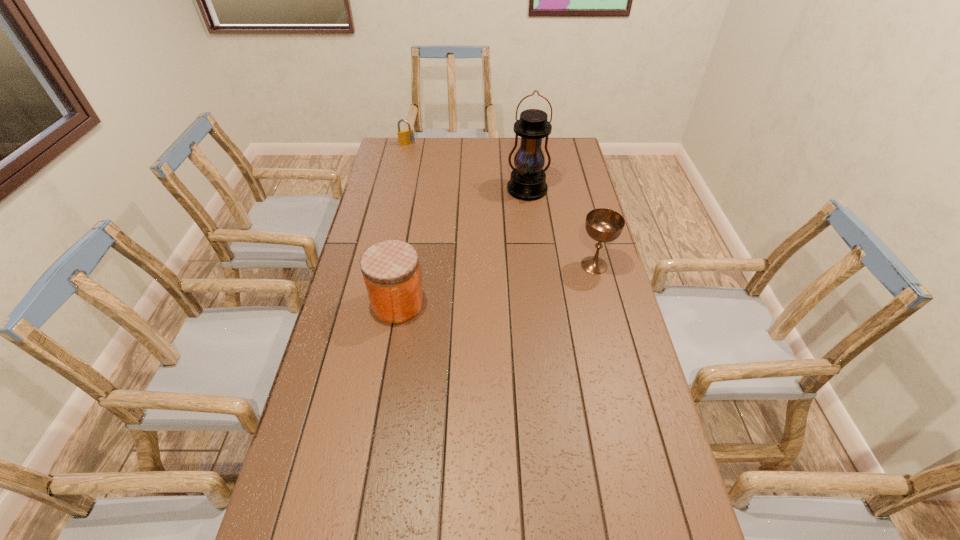
Locate an element on the screen. This screenshot has height=540, width=960. the nearest object is located at coordinates (390, 268).

The width and height of the screenshot is (960, 540). I want to click on the second nearest object, so click(604, 225).

You are a GUI agent. You are given a task and a screenshot of the screen. Output one action in this format:
    pyautogui.click(x=<x>, y=<y>)
    Task: Click on the rightmost object
    
    Given the screenshot: What is the action you would take?
    pyautogui.click(x=604, y=225)

You are a GUI agent. You are given a task and a screenshot of the screen. Output one action in this format:
    pyautogui.click(x=<x>, y=<y>)
    Task: Click on the third nearest object
    
    Given the screenshot: What is the action you would take?
    pyautogui.click(x=527, y=182)

Find the location of a particular element. This screenshot has width=960, height=540. the tallest object is located at coordinates (527, 182).

Where is `the farthest object`? The width and height of the screenshot is (960, 540). the farthest object is located at coordinates (405, 137).

Image resolution: width=960 pixels, height=540 pixels. I want to click on the shortest object, so click(405, 137).

You are a GUI agent. You are given a task and a screenshot of the screen. Output one action in this format:
    pyautogui.click(x=<x>, y=<y>)
    Task: Click on the free point located 0.330m on the back of the nearest object
    The height and width of the screenshot is (540, 960).
    Given the screenshot: What is the action you would take?
    pyautogui.click(x=412, y=221)

This screenshot has height=540, width=960. I want to click on vacant space located on the left of the second nearest object, so click(x=553, y=265).

Locate several points within vacant space situated 0.090m above the lantern, indicating its light source. Please provide its 2D coordinates. Your answer should be formatted as a tuple, i.e. [(x, y)], where the tuple contains the x and y coordinates of a point satisfying the conditions above.

[(525, 218)]